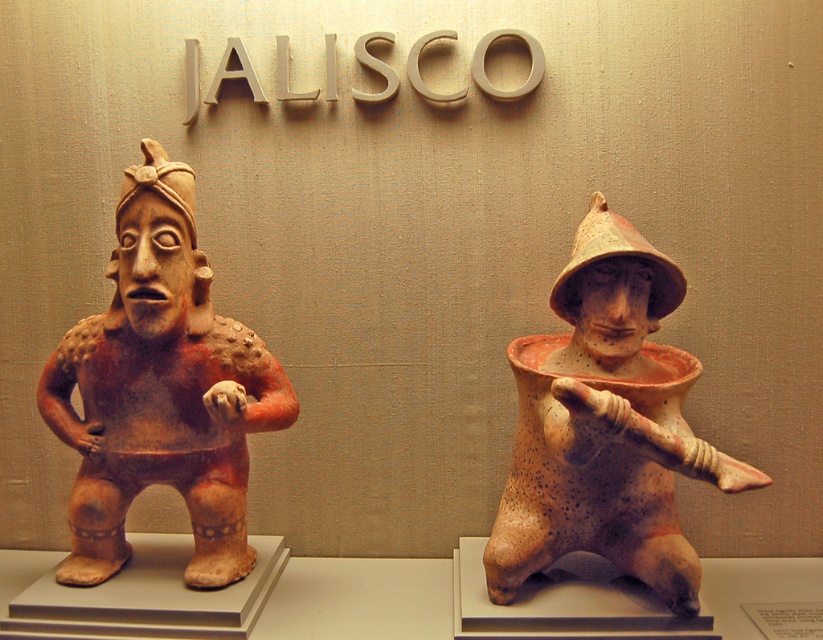
Question: Can you confirm if matte orange clay figure at left is thinner than speckled clay figure at center?

Choices:
 (A) yes
 (B) no

Answer: (B)

Question: Does matte orange clay figure at left have a larger size compared to speckled clay figure at center?

Choices:
 (A) yes
 (B) no

Answer: (A)

Question: Observing the image, what is the correct spatial positioning of matte orange clay figure at left in reference to speckled clay figure at center?

Choices:
 (A) left
 (B) right

Answer: (A)

Question: Which point is farther to the camera?

Choices:
 (A) speckled clay figure at center
 (B) matte orange clay figure at left

Answer: (B)

Question: Which object appears farthest from the camera in this image?

Choices:
 (A) speckled clay figure at center
 (B) matte orange clay figure at left

Answer: (B)